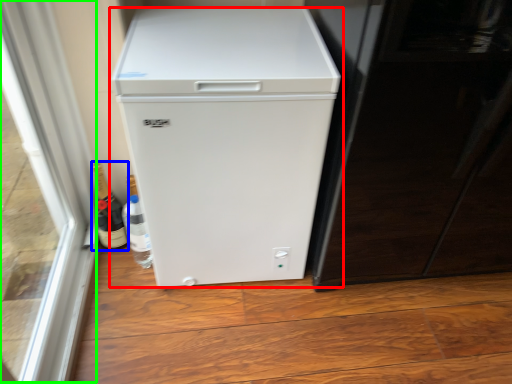
Question: Based on their relative distances, which object is nearer to refrigerator (highlighted by a red box)? Choose from bottle (highlighted by a blue box) and glass door (highlighted by a green box).

Choices:
 (A) bottle
 (B) glass door

Answer: (B)